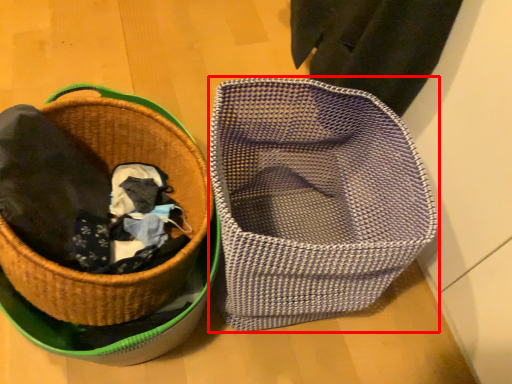
Question: From the image's perspective, what is the correct spatial relationship of basket (annotated by the red box) in relation to picnic basket?

Choices:
 (A) above
 (B) below

Answer: (B)